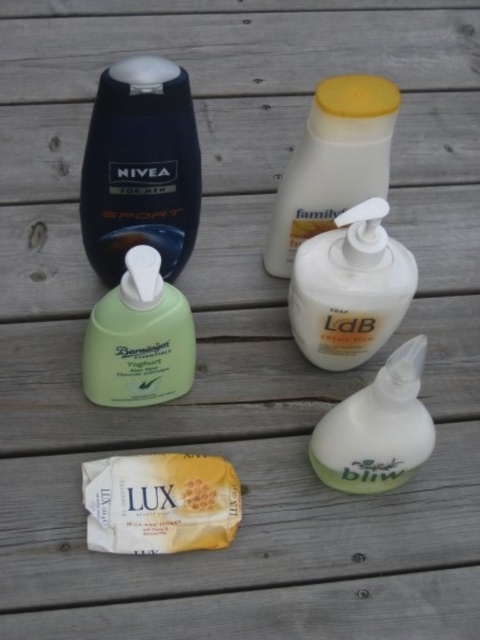
Who is more forward, (x=385, y=172) or (x=94, y=342)?

Positioned in front is point (x=94, y=342).

At what (x,y) coordinates should I click in order to perform the action: click on white matte lotion at upper center. Please return your answer as a coordinate pair (x, y). This screenshot has width=480, height=640. Looking at the image, I should click on (333, 163).

Who is taller, green matte hand soap at center or white matte squeeze bottle at lower right?

With more height is green matte hand soap at center.

Between green matte hand soap at center and white matte squeeze bottle at lower right, which one appears on the left side from the viewer's perspective?

green matte hand soap at center is more to the left.

Image resolution: width=480 pixels, height=640 pixels. I want to click on green matte hand soap at center, so click(139, 339).

Who is positioned more to the left, matte black bottle at upper left or white matte lotion at upper center?

matte black bottle at upper left is more to the left.

Is point (178, 259) farther from camera compared to point (277, 244)?

No.

The width and height of the screenshot is (480, 640). I want to click on matte black bottle at upper left, so click(141, 168).